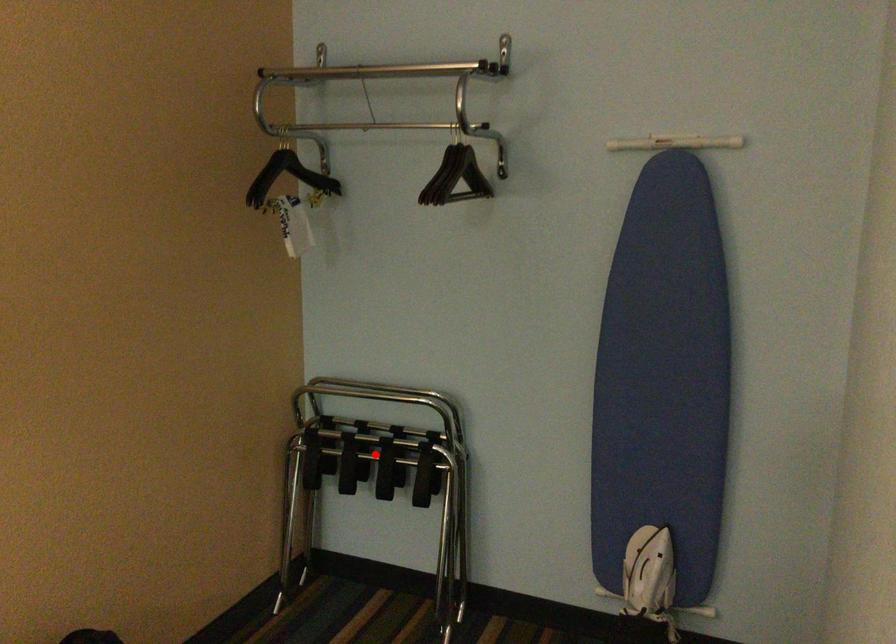
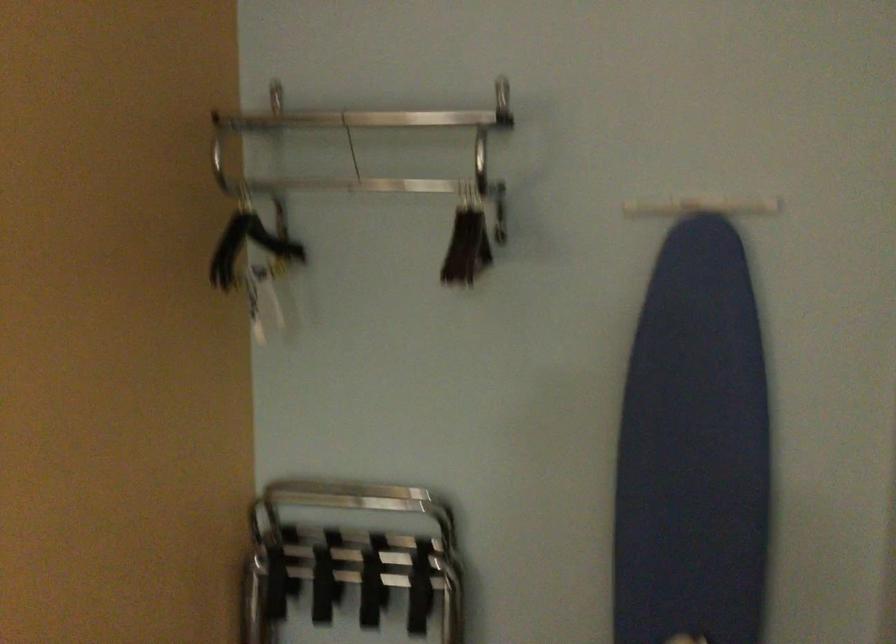
In the second image, find the point that corresponds to the highlighted location in the first image.

(350, 562)